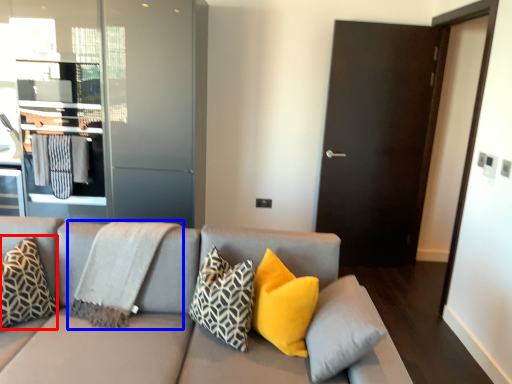
Question: Which object appears closest to the camera in this image, pillow (highlighted by a red box) or blanket (highlighted by a blue box)?

Choices:
 (A) pillow
 (B) blanket

Answer: (A)